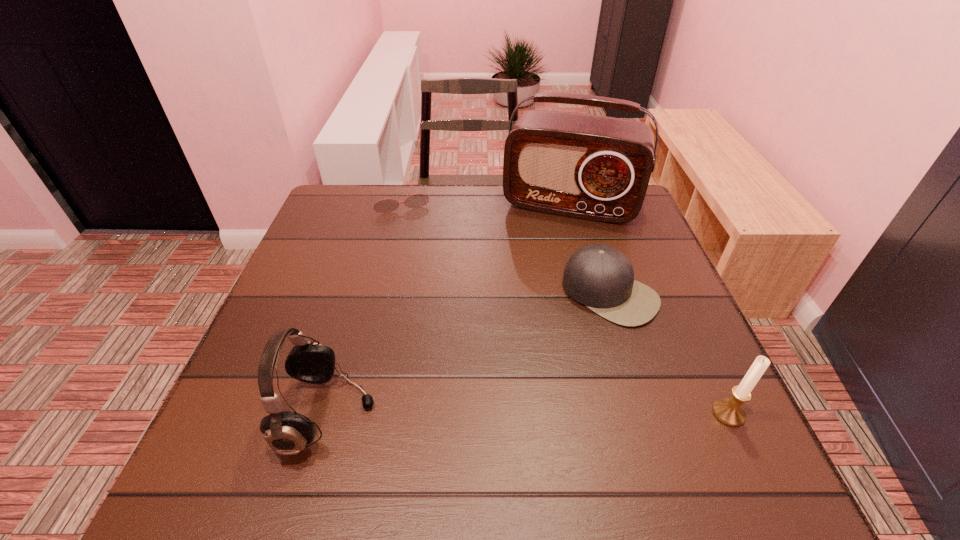
This screenshot has height=540, width=960. I want to click on free space located 0.060m on the brim of the cap, so click(572, 336).

Find the location of `free space located on the front panel of the radio receiver`. free space located on the front panel of the radio receiver is located at coordinates (550, 245).

Locate an element on the screen. The width and height of the screenshot is (960, 540). vacant space located on the front panel of the radio receiver is located at coordinates (537, 288).

This screenshot has height=540, width=960. Identify the location of free spot located 0.390m on the front panel of the radio receiver. (524, 332).

Locate an element on the screen. free spot located 0.260m on the face of the sunglasses is located at coordinates (425, 272).

Where is `vacant space situated on the face of the sunglasses`? This screenshot has width=960, height=540. vacant space situated on the face of the sunglasses is located at coordinates (429, 283).

Where is `vacant space positioned 0.310m on the face of the sunglasses`? This screenshot has height=540, width=960. vacant space positioned 0.310m on the face of the sunglasses is located at coordinates (429, 286).

Locate an element on the screen. This screenshot has width=960, height=540. radio receiver that is at the far edge is located at coordinates (592, 167).

Where is `sunglasses located at the far edge`? The width and height of the screenshot is (960, 540). sunglasses located at the far edge is located at coordinates (417, 200).

Locate an element on the screen. Image resolution: width=960 pixels, height=540 pixels. headset that is at the near edge is located at coordinates (287, 433).